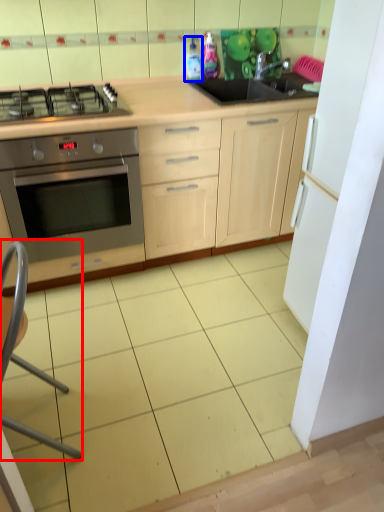
Question: Which point is closer to the camera, folding chair (highlighted by a red box) or bottle (highlighted by a blue box)?

Choices:
 (A) folding chair
 (B) bottle

Answer: (A)